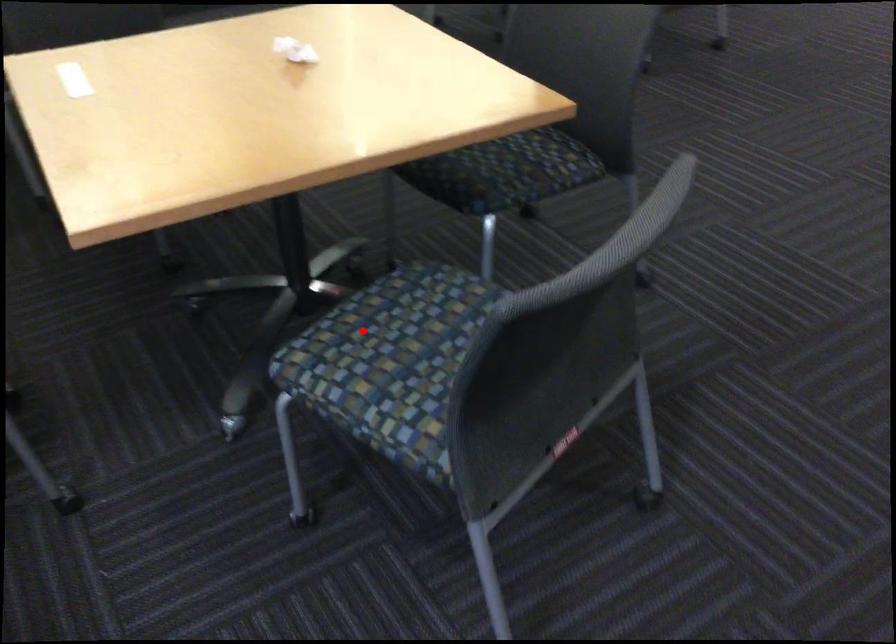
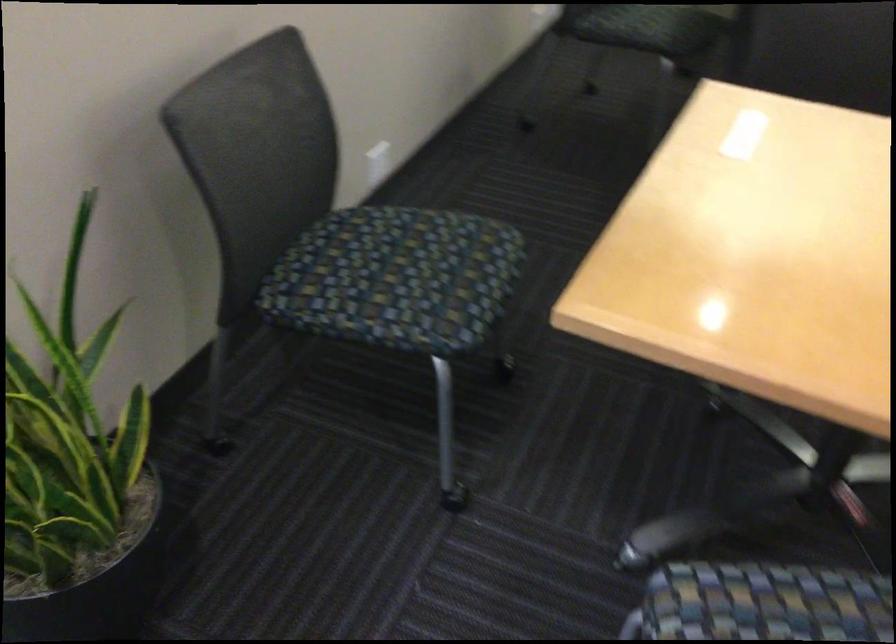
Locate, in the second image, the point that corresponds to the highlighted location in the first image.

(765, 603)